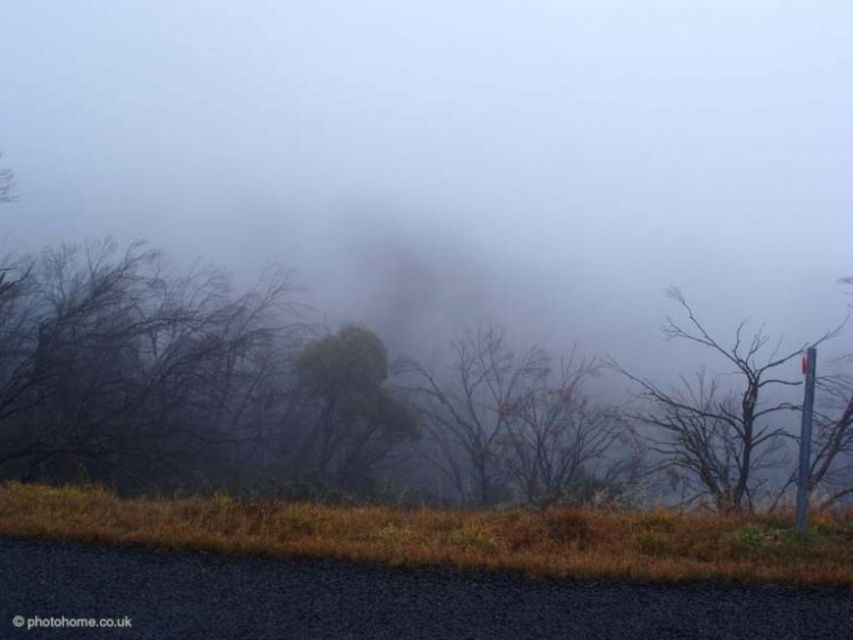
Question: Which point is farther from the camera taking this photo?

Choices:
 (A) (352, 333)
 (B) (666, 396)
 (C) (796, 470)

Answer: (A)

Question: Which of the following is the farthest from the observer?

Choices:
 (A) green matte tree at center
 (B) metallic pole at right
 (C) smooth gray pole at right

Answer: (A)

Question: Which point is farther to the camera?

Choices:
 (A) metallic pole at right
 (B) smooth gray pole at right

Answer: (B)

Question: Can you confirm if green matte tree at center is positioned to the left of metallic pole at right?

Choices:
 (A) yes
 (B) no

Answer: (A)

Question: Can you confirm if green matte tree at center is wider than metallic pole at right?

Choices:
 (A) no
 (B) yes

Answer: (B)

Question: Can you confirm if green matte tree at center is positioned above metallic pole at right?

Choices:
 (A) no
 (B) yes

Answer: (A)